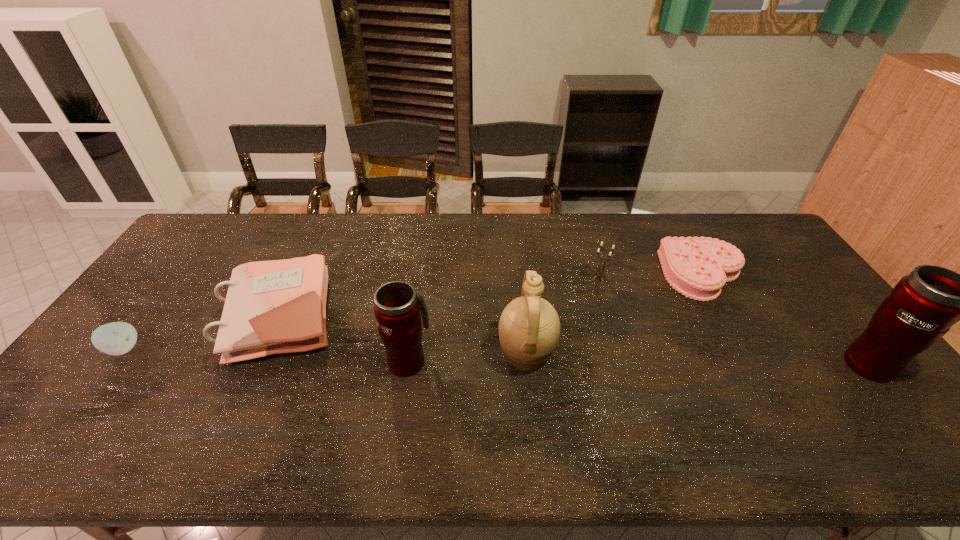
Identify the location of the shorter thermos bottle. This screenshot has height=540, width=960. (397, 307).

At what (x,y) coordinates should I click in order to perform the action: click on the left thermos bottle. Please return your answer as a coordinate pair (x, y). The height and width of the screenshot is (540, 960). Looking at the image, I should click on (397, 307).

Locate an element on the screen. the rightmost object is located at coordinates (923, 306).

What are the coordinates of `the right thermos bottle` in the screenshot? It's located at (923, 306).

Find the location of `the fourth shortest object`. the fourth shortest object is located at coordinates (599, 274).

The width and height of the screenshot is (960, 540). In order to click on the fifth object from left to right in this screenshot , I will do `click(599, 274)`.

Where is `the sixth object from right to left`? This screenshot has width=960, height=540. the sixth object from right to left is located at coordinates (271, 307).

In order to click on the fourth object from right to left in this screenshot , I will do `click(529, 327)`.

At what (x,y) coordinates should I click in order to perform the action: click on the second object from right to left. Please return your answer as a coordinate pair (x, y). This screenshot has height=540, width=960. Looking at the image, I should click on (697, 267).

Locate an element on the screen. The image size is (960, 540). the shortest object is located at coordinates (697, 267).